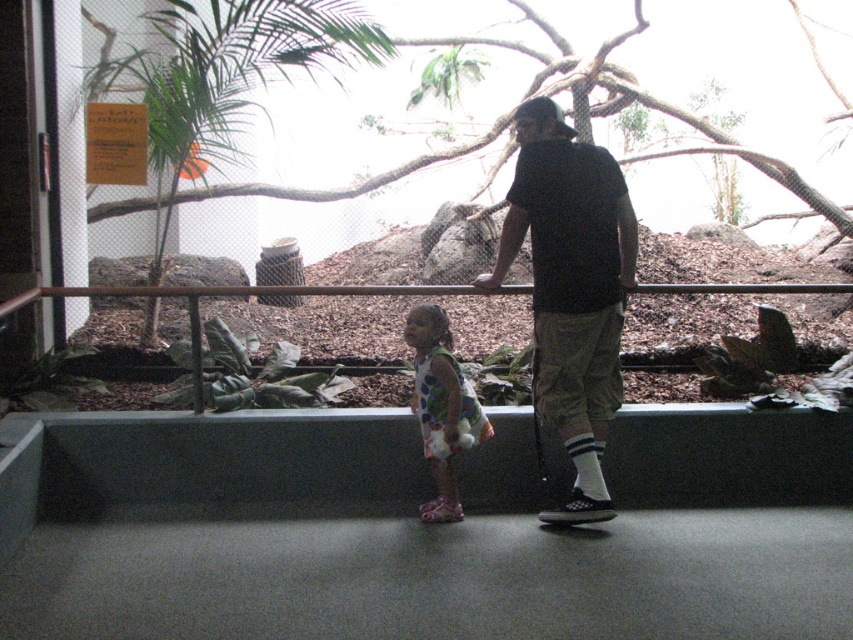
Does dark gray cotton shirt at center have a smaller size compared to printed fabric dress at center?

Incorrect, dark gray cotton shirt at center is not smaller in size than printed fabric dress at center.

Can you confirm if dark gray cotton shirt at center is shorter than printed fabric dress at center?

No.

Does point (618, 180) come farther from viewer compared to point (434, 371)?

Yes, it is behind point (434, 371).

Where is `dark gray cotton shirt at center`? dark gray cotton shirt at center is located at coordinates (572, 289).